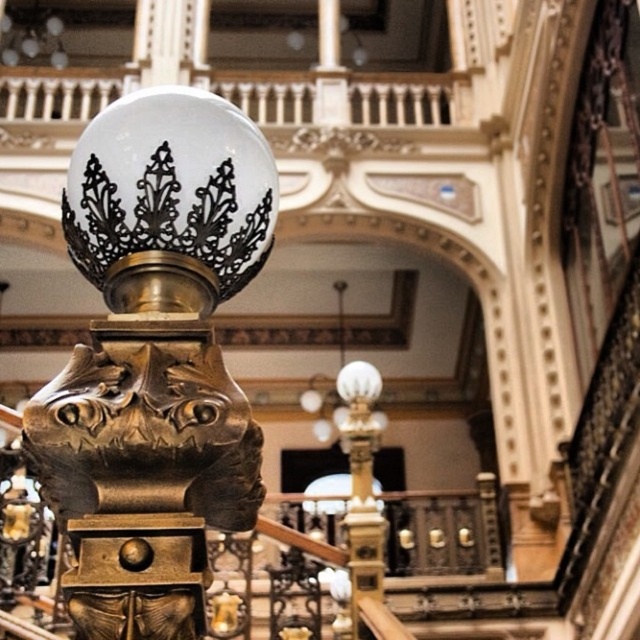
Who is higher up, matte gold sculpture at center or gold polished metal lamp post at center?

matte gold sculpture at center

Where is `matte gold sculpture at center`? matte gold sculpture at center is located at coordinates (157, 314).